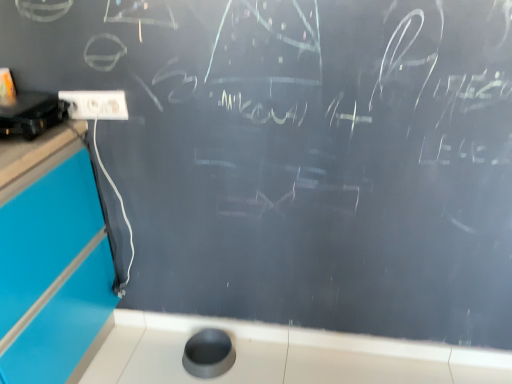
Question: Does black plastic projector at upper left appear on the left side of white glossy counter top at lower center?

Choices:
 (A) yes
 (B) no

Answer: (A)

Question: Can you confirm if black plastic projector at upper left is smaller than white glossy counter top at lower center?

Choices:
 (A) no
 (B) yes

Answer: (A)

Question: Can you confirm if black plastic projector at upper left is positioned to the right of white glossy counter top at lower center?

Choices:
 (A) no
 (B) yes

Answer: (A)

Question: Is black plastic projector at upper left not inside white glossy counter top at lower center?

Choices:
 (A) yes
 (B) no

Answer: (A)

Question: Can you confirm if black plastic projector at upper left is wider than white glossy counter top at lower center?

Choices:
 (A) no
 (B) yes

Answer: (B)

Question: In the image, is black plastic projector at upper left on the left side or the right side of white plastic electric outlet at upper left?

Choices:
 (A) left
 (B) right

Answer: (A)

Question: From a real-world perspective, is black plastic projector at upper left positioned above or below white plastic electric outlet at upper left?

Choices:
 (A) below
 (B) above

Answer: (B)

Question: Does point (32, 132) appear closer or farther from the camera than point (105, 94)?

Choices:
 (A) closer
 (B) farther

Answer: (A)

Question: Considering their positions, is black plastic projector at upper left located in front of or behind white plastic electric outlet at upper left?

Choices:
 (A) front
 (B) behind

Answer: (A)

Question: From a real-world perspective, relative to black plastic projector at upper left, is white glossy counter top at lower center vertically above or below?

Choices:
 (A) above
 (B) below

Answer: (B)

Question: Based on their sizes in the image, would you say white glossy counter top at lower center is bigger or smaller than black plastic projector at upper left?

Choices:
 (A) small
 (B) big

Answer: (A)

Question: Considering the positions of white glossy counter top at lower center and black plastic projector at upper left in the image, is white glossy counter top at lower center taller or shorter than black plastic projector at upper left?

Choices:
 (A) tall
 (B) short

Answer: (A)

Question: Which is correct: white glossy counter top at lower center is inside black plastic projector at upper left, or outside of it?

Choices:
 (A) outside
 (B) inside

Answer: (A)

Question: From a real-world perspective, is white plastic electric outlet at upper left physically located above or below black plastic projector at upper left?

Choices:
 (A) below
 (B) above

Answer: (A)

Question: Relative to black plastic projector at upper left, is white plastic electric outlet at upper left in front or behind?

Choices:
 (A) behind
 (B) front

Answer: (A)